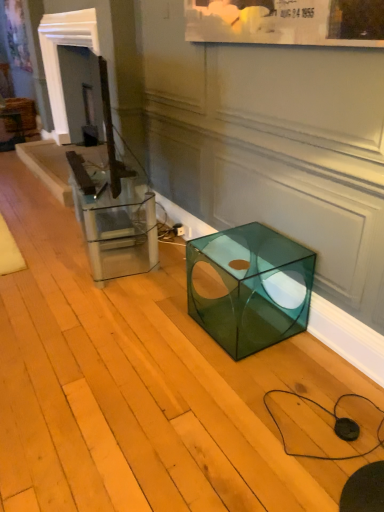
Question: From a real-world perspective, is clear glass cube at center positioned over transparent green cube at lower right based on gravity?

Choices:
 (A) yes
 (B) no

Answer: (A)

Question: Considering the relative sizes of clear glass cube at center and transparent green cube at lower right in the image provided, is clear glass cube at center taller than transparent green cube at lower right?

Choices:
 (A) no
 (B) yes

Answer: (B)

Question: Is clear glass cube at center facing away from transparent green cube at lower right?

Choices:
 (A) no
 (B) yes

Answer: (A)

Question: From the image's perspective, does clear glass cube at center appear lower than transparent green cube at lower right?

Choices:
 (A) no
 (B) yes

Answer: (A)

Question: Is clear glass cube at center bigger than transparent green cube at lower right?

Choices:
 (A) no
 (B) yes

Answer: (B)

Question: Considering the relative sizes of clear glass cube at center and transparent green cube at lower right in the image provided, is clear glass cube at center smaller than transparent green cube at lower right?

Choices:
 (A) yes
 (B) no

Answer: (B)

Question: Is clear glass cube at center in front of white glossy fireplace at upper left?

Choices:
 (A) no
 (B) yes

Answer: (B)

Question: Considering the relative sizes of clear glass cube at center and white glossy fireplace at upper left in the image provided, is clear glass cube at center taller than white glossy fireplace at upper left?

Choices:
 (A) yes
 (B) no

Answer: (B)

Question: Is clear glass cube at center facing towards white glossy fireplace at upper left?

Choices:
 (A) yes
 (B) no

Answer: (B)

Question: Is the depth of clear glass cube at center greater than that of white glossy fireplace at upper left?

Choices:
 (A) yes
 (B) no

Answer: (B)

Question: Are clear glass cube at center and white glossy fireplace at upper left beside each other?

Choices:
 (A) no
 (B) yes

Answer: (A)

Question: Considering the relative sizes of clear glass cube at center and white glossy fireplace at upper left in the image provided, is clear glass cube at center wider than white glossy fireplace at upper left?

Choices:
 (A) no
 (B) yes

Answer: (A)

Question: From the image's perspective, is white glossy fireplace at upper left under transparent green cube at lower right?

Choices:
 (A) yes
 (B) no

Answer: (B)